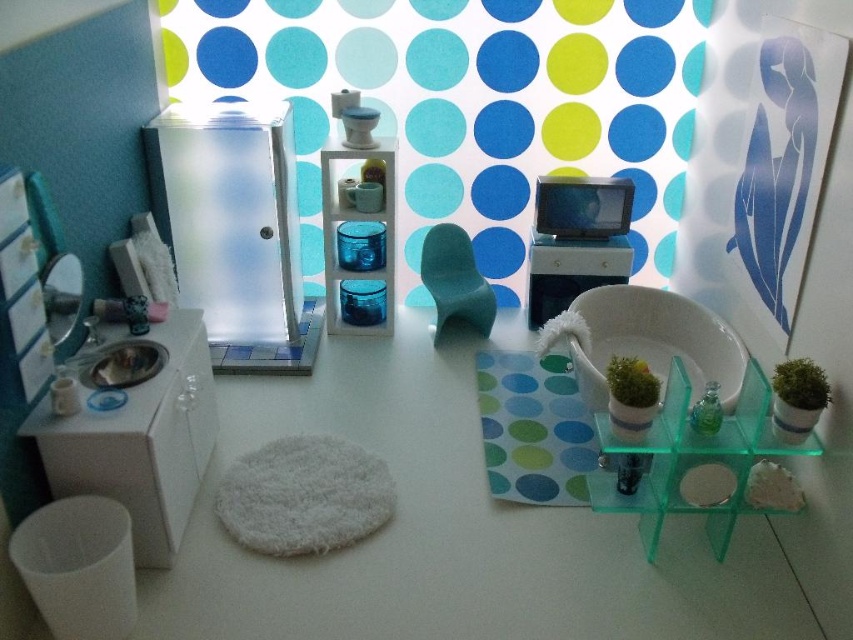
What do you see at coordinates (691, 460) in the screenshot? I see `translucent green glass shelf at center right` at bounding box center [691, 460].

The width and height of the screenshot is (853, 640). Identify the location of translucent green glass shelf at center right. (691, 460).

I want to click on translucent green glass shelf at center right, so click(691, 460).

Which is more to the right, frosted glass cabinet at upper left or green mossy plant at right?

green mossy plant at right

Does frosted glass cabinet at upper left have a lesser width compared to green mossy plant at right?

Incorrect, frosted glass cabinet at upper left's width is not less than green mossy plant at right's.

Is point (616, 22) positioned after point (802, 360)?

Yes, it is.

Find the location of `frosted glass cabinet at upper left`. frosted glass cabinet at upper left is located at coordinates (468, 106).

This screenshot has height=640, width=853. Describe the element at coordinates (468, 106) in the screenshot. I see `frosted glass cabinet at upper left` at that location.

Where is `frosted glass cabinet at upper left`? frosted glass cabinet at upper left is located at coordinates (468, 106).